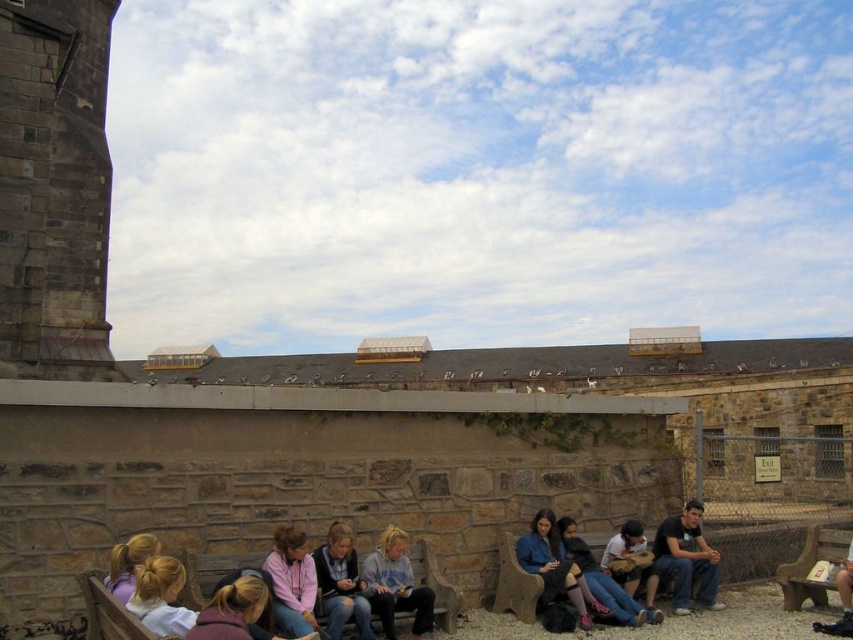
Question: Which point is farther to the camera?

Choices:
 (A) brown wooden bench at lower right
 (B) light brown leather jacket at center
 (C) denim jacket at lower right
 (D) pink fleece jacket at lower center

Answer: (B)

Question: Which object is closer to the camera taking this photo?

Choices:
 (A) blonde hair at lower center
 (B) brown wooden bench at lower right
 (C) purple fabric hair at lower left
 (D) matte gray hoodie at center

Answer: (A)

Question: Is pink fleece jacket at lower center wider than blonde hair at lower left?

Choices:
 (A) yes
 (B) no

Answer: (B)

Question: Can you confirm if denim jeans at lower center is smaller than denim jacket at center?

Choices:
 (A) no
 (B) yes

Answer: (A)

Question: Where is blonde hair at lower center located in relation to light brown leather jacket at center in the image?

Choices:
 (A) above
 (B) below

Answer: (A)

Question: Based on their relative distances, which object is nearer to the light brown leather jacket at center?

Choices:
 (A) blonde hair at lower left
 (B) dark gray stone tower at left

Answer: (A)